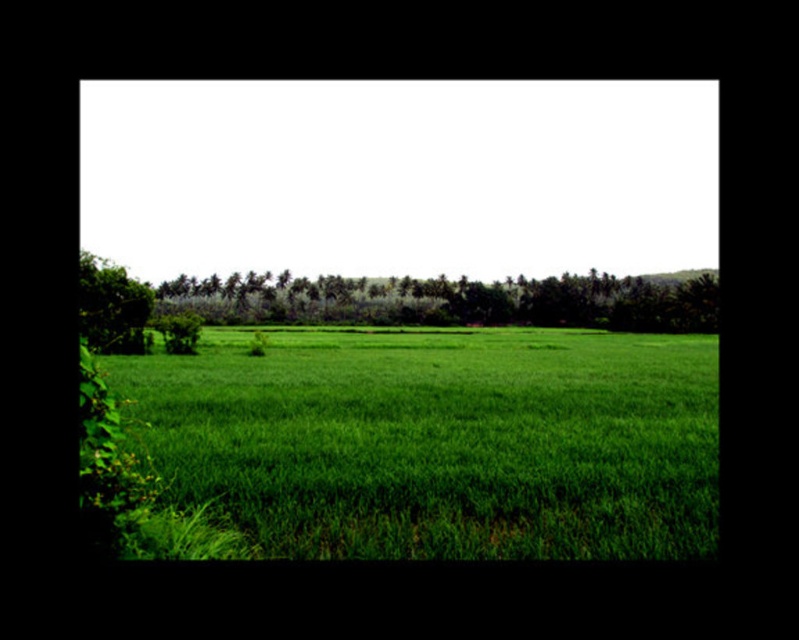
This screenshot has height=640, width=799. What do you see at coordinates (439, 440) in the screenshot?
I see `green grassy field at center` at bounding box center [439, 440].

Can you confirm if green grassy field at center is taller than green leafy tree at left?

No, green grassy field at center is not taller than green leafy tree at left.

Between point (219, 464) and point (149, 300), which one is positioned in front?

Point (219, 464) is more forward.

This screenshot has height=640, width=799. In order to click on green grassy field at center in this screenshot , I will do `click(439, 440)`.

Between green leafy trees at center and green leafy tree at left, which one is positioned higher?

green leafy trees at center is higher up.

Which is behind, point (579, 326) or point (86, 252)?

The point (579, 326) is more distant.

At what (x,y) coordinates should I click in order to perform the action: click on green leafy trees at center. Please return your answer as a coordinate pair (x, y). Looking at the image, I should click on (456, 300).

Can you confirm if green grassy field at center is taller than green leafy trees at center?

In fact, green grassy field at center may be shorter than green leafy trees at center.

Where is `green grassy field at center`? The height and width of the screenshot is (640, 799). green grassy field at center is located at coordinates [439, 440].